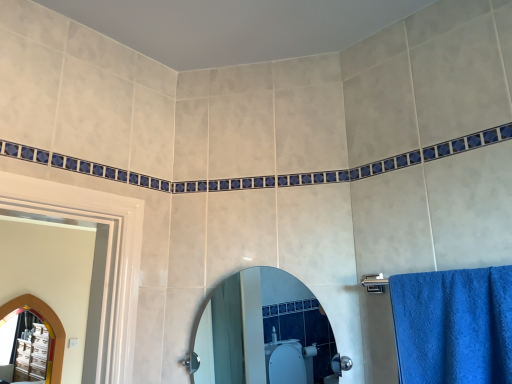
Question: Does arched wooden mirror at left, which appears as the first mirror when viewed from the left, appear on the right side of clear glass mirror at center, which is the first mirror from front to back?

Choices:
 (A) no
 (B) yes

Answer: (A)

Question: From the image's perspective, is arched wooden mirror at left, which appears as the first mirror when viewed from the left, located beneath clear glass mirror at center, the 1th mirror positioned from the right?

Choices:
 (A) no
 (B) yes

Answer: (B)

Question: From a real-world perspective, does arched wooden mirror at left, arranged as the 2th mirror when viewed from the top, sit lower than clear glass mirror at center, positioned as the second mirror in back-to-front order?

Choices:
 (A) no
 (B) yes

Answer: (B)

Question: Considering the relative sizes of arched wooden mirror at left, the 2th mirror positioned from the front, and clear glass mirror at center, which is the first mirror from front to back, in the image provided, is arched wooden mirror at left, the 2th mirror positioned from the front, shorter than clear glass mirror at center, which is the first mirror from front to back,?

Choices:
 (A) yes
 (B) no

Answer: (B)

Question: Is arched wooden mirror at left, which is counted as the 1th mirror, starting from the back, further to the viewer compared to clear glass mirror at center, which is the first mirror from front to back?

Choices:
 (A) yes
 (B) no

Answer: (A)

Question: Would you say arched wooden mirror at left, which appears as the first mirror when viewed from the left, is outside clear glass mirror at center, the first mirror from the top?

Choices:
 (A) yes
 (B) no

Answer: (A)

Question: From a real-world perspective, is clear glass mirror at center, placed as the second mirror when sorted from bottom to top, below arched wooden mirror at left, which is counted as the 1th mirror, starting from the back?

Choices:
 (A) yes
 (B) no

Answer: (B)

Question: Considering the relative sizes of clear glass mirror at center, the first mirror from the top, and arched wooden mirror at left, the 2th mirror positioned from the front, in the image provided, is clear glass mirror at center, the first mirror from the top, bigger than arched wooden mirror at left, the 2th mirror positioned from the front,?

Choices:
 (A) yes
 (B) no

Answer: (B)

Question: Considering the relative sizes of clear glass mirror at center, placed as the second mirror when sorted from left to right, and arched wooden mirror at left, which appears as the first mirror when viewed from the left, in the image provided, is clear glass mirror at center, placed as the second mirror when sorted from left to right, wider than arched wooden mirror at left, which appears as the first mirror when viewed from the left,?

Choices:
 (A) yes
 (B) no

Answer: (A)

Question: Is clear glass mirror at center, positioned as the second mirror in back-to-front order, shorter than arched wooden mirror at left, the 2th mirror positioned from the front?

Choices:
 (A) yes
 (B) no

Answer: (A)

Question: Is clear glass mirror at center, placed as the second mirror when sorted from left to right, at the right side of arched wooden mirror at left, the 2th mirror positioned from the front?

Choices:
 (A) no
 (B) yes

Answer: (B)

Question: Can you confirm if clear glass mirror at center, positioned as the second mirror in back-to-front order, is smaller than arched wooden mirror at left, which appears as the first mirror when viewed from the left?

Choices:
 (A) yes
 (B) no

Answer: (A)

Question: Is arched wooden mirror at left, which appears as the first mirror when viewed from the left, to the left or to the right of clear glass mirror at center, placed as the second mirror when sorted from left to right, in the image?

Choices:
 (A) right
 (B) left

Answer: (B)